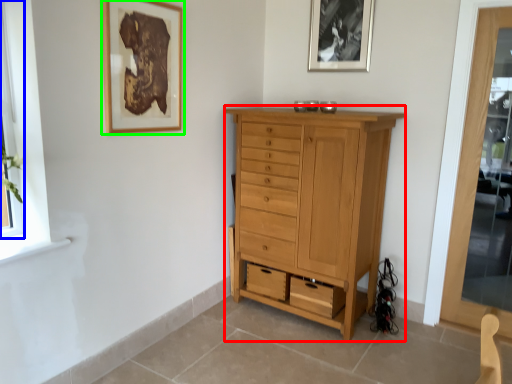
Question: Which object is positioned closest to chest of drawers (highlighted by a red box)? Select from window (highlighted by a blue box) and picture frame (highlighted by a green box).

Choices:
 (A) window
 (B) picture frame

Answer: (B)